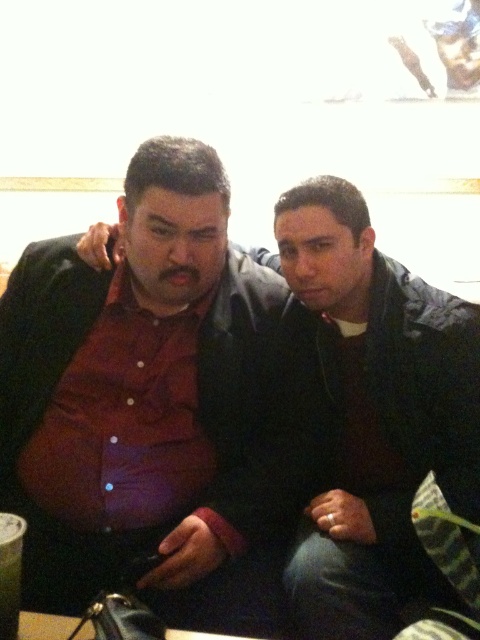
Question: Can you confirm if matte black jacket at center is wider than clear plastic cup at lower left?

Choices:
 (A) yes
 (B) no

Answer: (A)

Question: Which of these objects is positioned farthest from the matte black shirt at center?

Choices:
 (A) matte black jacket at center
 (B) clear plastic cup at lower left

Answer: (B)

Question: Which object is positioned closest to the clear plastic cup at lower left?

Choices:
 (A) matte black shirt at center
 (B) matte black jacket at center

Answer: (A)

Question: Does matte black jacket at center appear under clear plastic cup at lower left?

Choices:
 (A) yes
 (B) no

Answer: (B)

Question: Can you confirm if matte black jacket at center is bigger than clear plastic cup at lower left?

Choices:
 (A) no
 (B) yes

Answer: (B)

Question: Which of these objects is positioned farthest from the matte black shirt at center?

Choices:
 (A) clear plastic cup at lower left
 (B) matte black jacket at center

Answer: (A)